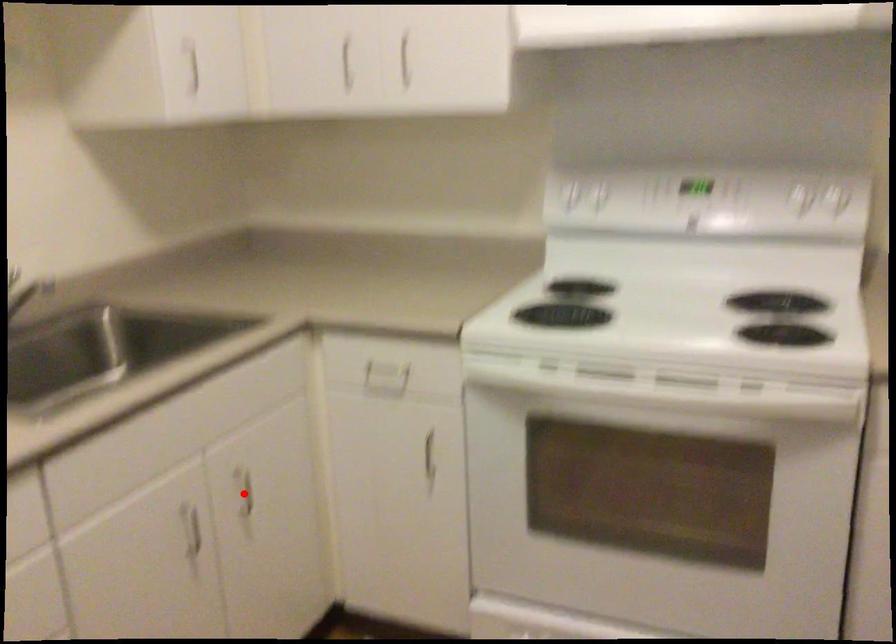
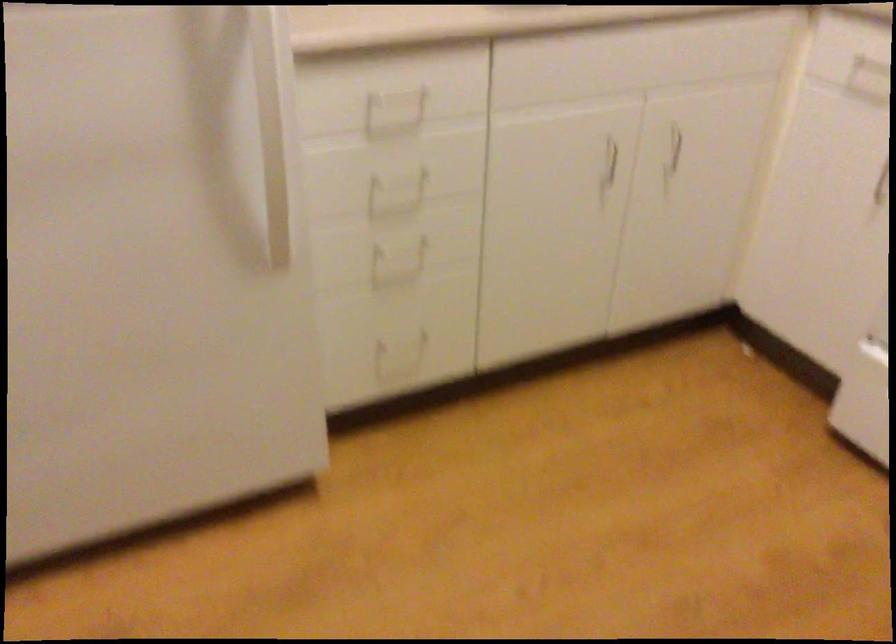
The point at the highlighted location is marked in the first image. Where is the corresponding point in the second image?

(675, 147)